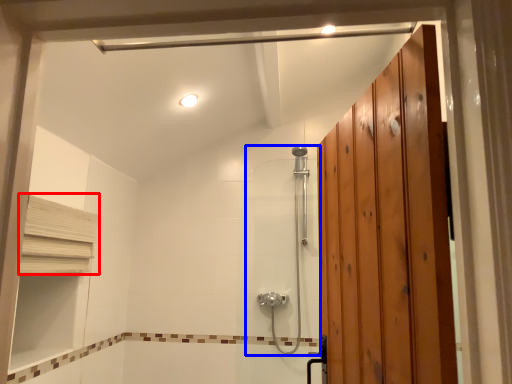
Question: Among these objects, which one is farthest to the camera, shelf (highlighted by a red box) or shower door (highlighted by a blue box)?

Choices:
 (A) shelf
 (B) shower door

Answer: (B)